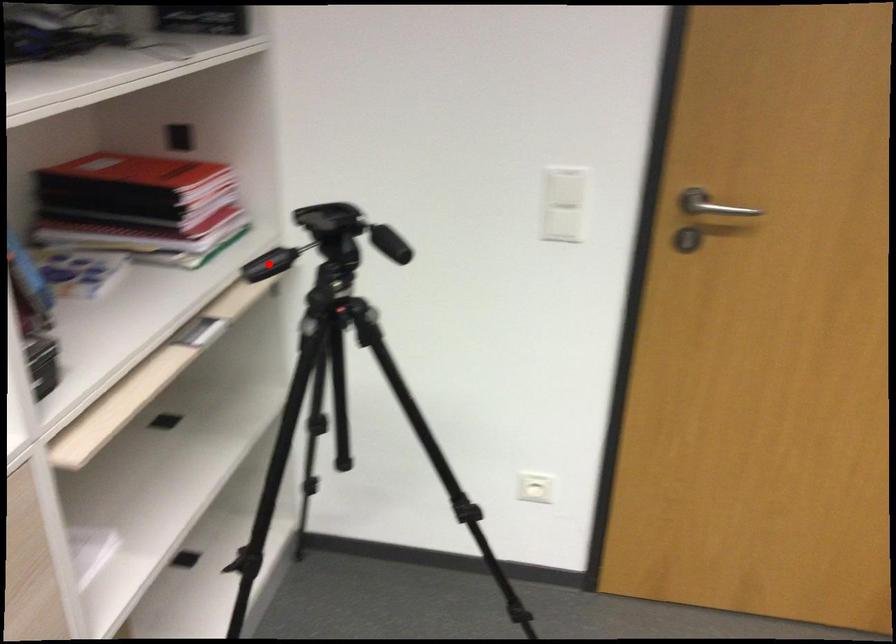
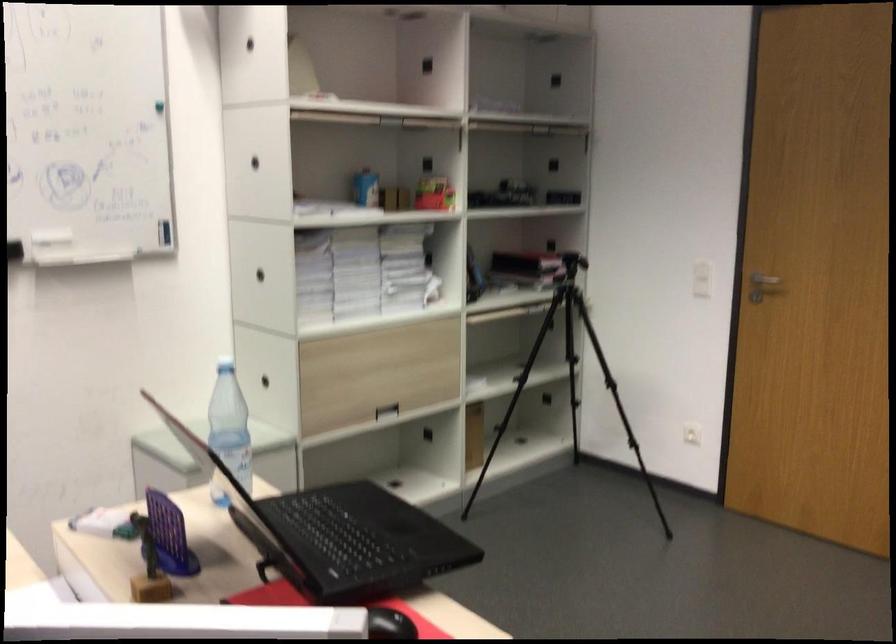
Question: I am providing you with two images of the same scene from different viewpoints. A red point is marked on the first image. Can you still see the location of the red point in image 2?

Choices:
 (A) Yes
 (B) No

Answer: (B)